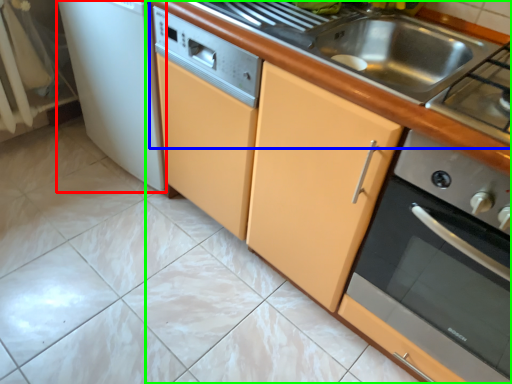
Question: Considering the real-world distances, which object is farthest from home appliance (highlighted by a red box)? counter top (highlighted by a blue box) or countertop (highlighted by a green box)?

Choices:
 (A) counter top
 (B) countertop

Answer: (A)